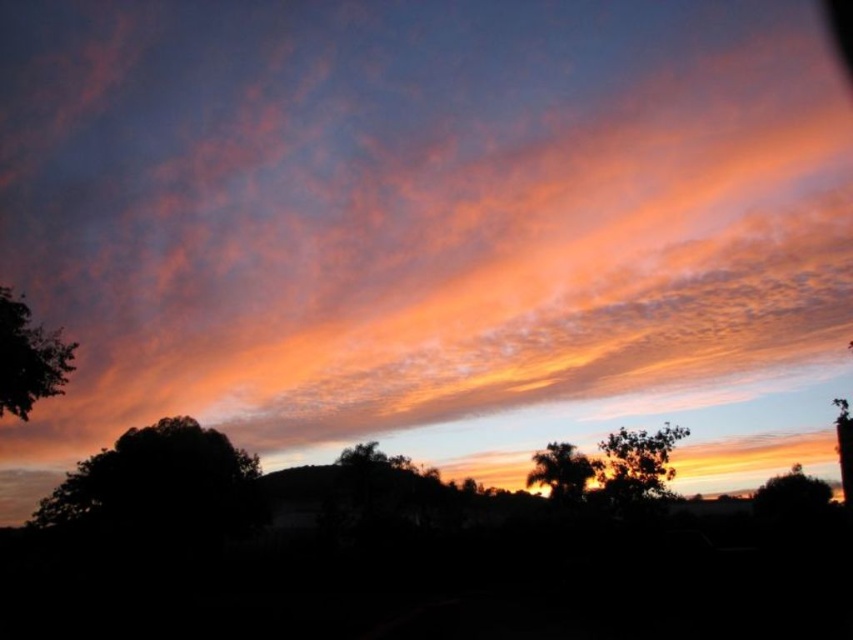
Question: Which object appears closest to the camera in this image?

Choices:
 (A) green leafy tree at lower right
 (B) silhouette tree at left

Answer: (A)

Question: Among these points, which one is farthest from the camera?

Choices:
 (A) (184, 474)
 (B) (103, 209)
 (C) (605, 458)

Answer: (B)

Question: Is silhouette tree at left closer to camera compared to green leafy tree at center?

Choices:
 (A) yes
 (B) no

Answer: (B)

Question: Which of the following is the farthest from the observer?

Choices:
 (A) cloudy sky at upper center
 (B) silhouetted tree at center

Answer: (B)

Question: From the image, what is the correct spatial relationship of green leafy tree at left in relation to green leafy tree at lower right?

Choices:
 (A) above
 (B) below

Answer: (A)

Question: Is cloudy sky at upper center to the right of green leafy tree at center from the viewer's perspective?

Choices:
 (A) yes
 (B) no

Answer: (B)